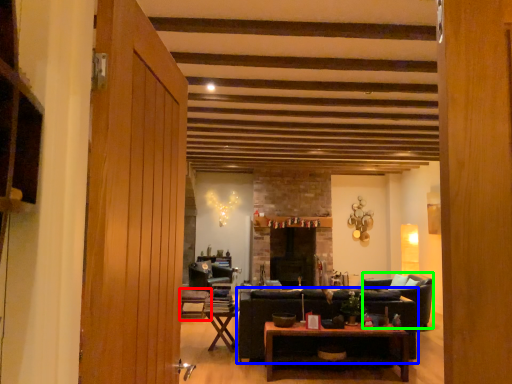
Question: Which object is positioned farthest from chair (highlighted by a red box)? Select from studio couch (highlighted by a blue box) and armchair (highlighted by a green box).

Choices:
 (A) studio couch
 (B) armchair

Answer: (B)